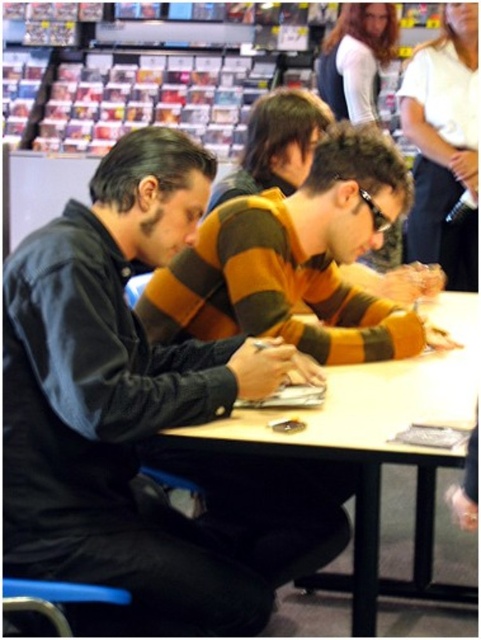
You are a customer in the bookstore and want to buy the dark blue denim jacket at center. Is it displayed on a mannequin or placed on a table?

The dark blue denim jacket at center is placed on a table because its coordinates are at point (118, 396), which corresponds to the table area in the image.

You are a customer in the bookstore and want to place a book on the table. Can you put the book directly behind the dark blue denim jacket at center on the light brown wood table at center?

The dark blue denim jacket at center is in front of the light brown wood table at center, so there is space behind the dark blue denim jacket at center on the table to place the book.

You are organizing a small event in this bookstore and need to place a 1.2 meter long banner on the table. Given the dark blue denim jacket at center and the light brown wood table at center, will there be enough space for the banner?

The dark blue denim jacket at center occupies less space than the light brown wood table at center, but the table size isn not specified. Without knowing the table dimensions, it is impossible to determine if the banner will fit.